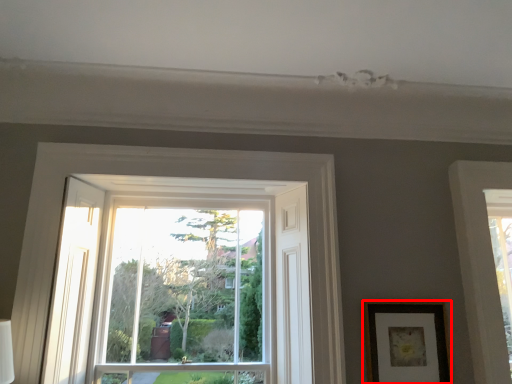
Question: Considering the relative positions of picture frame (annotated by the red box) and bay window in the image provided, where is picture frame (annotated by the red box) located with respect to the staircase?

Choices:
 (A) right
 (B) left

Answer: (A)